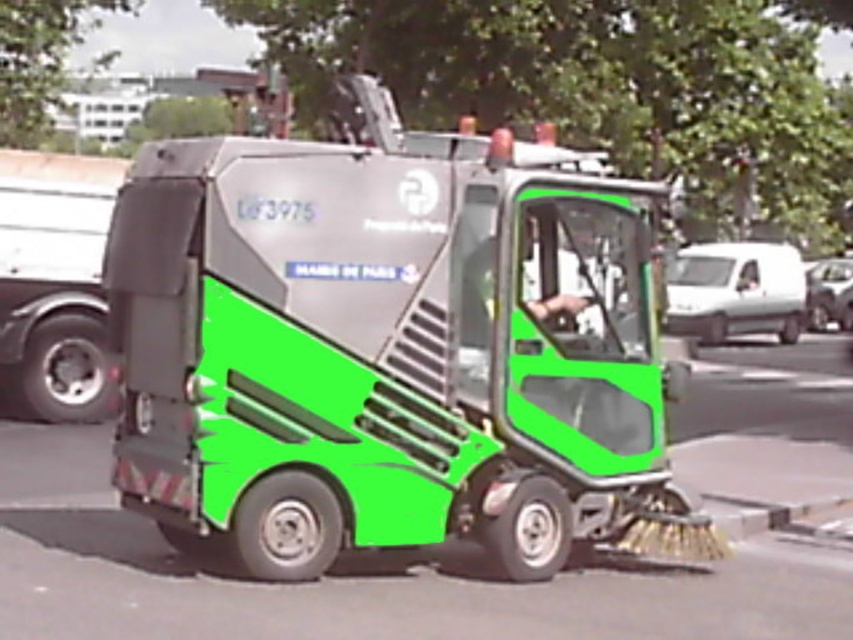
You are standing on the sidewalk and see the metallic gray garbage truck at center. If the truck starts moving forward, will it come closer to you or move away?

The metallic gray garbage truck at center is 24.31 feet away from the viewer. If it moves forward, it will come closer to you.

You are a pedestrian standing on the sidewalk. You see a metallic silver truck at left and a smooth skin hand at center. Which object is wider?

The metallic silver truck at left is wider than the smooth skin hand at center.

You are a pedestrian standing at the point labeled as point (54, 282). What type of vehicle do you see to your immediate left?

The point (54, 282) indicates a metallic silver truck at left, so you see a metallic silver truck to your immediate left.